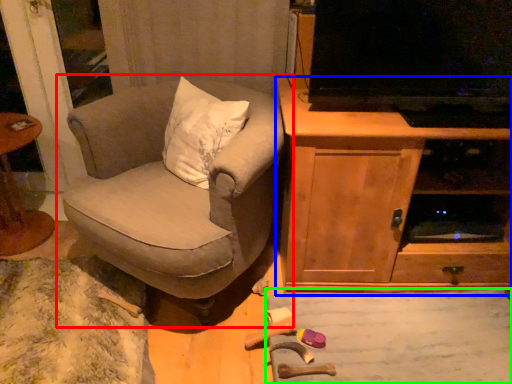
Question: Which object is the closest to the chair (highlighted by a red box)? Choose among these: cabinetry (highlighted by a blue box) or plain (highlighted by a green box).

Choices:
 (A) cabinetry
 (B) plain

Answer: (A)